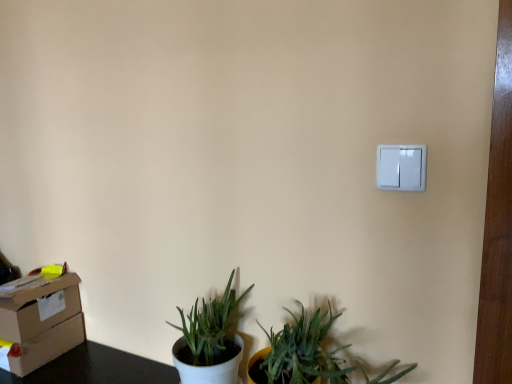
Question: Is matte brown cardboard box at lower left positioned before white matte pot at lower left?

Choices:
 (A) yes
 (B) no

Answer: (B)

Question: Is matte brown cardboard box at lower left directly adjacent to white matte pot at lower left?

Choices:
 (A) no
 (B) yes

Answer: (A)

Question: Does matte brown cardboard box at lower left lie behind white matte pot at lower left?

Choices:
 (A) yes
 (B) no

Answer: (A)

Question: From a real-world perspective, is matte brown cardboard box at lower left over white matte pot at lower left?

Choices:
 (A) yes
 (B) no

Answer: (B)

Question: Is white matte pot at lower left at the back of matte brown cardboard box at lower left?

Choices:
 (A) yes
 (B) no

Answer: (B)

Question: Does matte brown cardboard box at lower left have a lesser height compared to white matte pot at lower left?

Choices:
 (A) no
 (B) yes

Answer: (B)

Question: From the image's perspective, is white plastic light switch at upper right beneath white matte pot at lower left?

Choices:
 (A) no
 (B) yes

Answer: (A)

Question: Would you say white matte pot at lower left is part of white plastic light switch at upper right's contents?

Choices:
 (A) no
 (B) yes

Answer: (A)

Question: Is white plastic light switch at upper right wider than white matte pot at lower left?

Choices:
 (A) no
 (B) yes

Answer: (A)

Question: Is white plastic light switch at upper right bigger than white matte pot at lower left?

Choices:
 (A) no
 (B) yes

Answer: (A)

Question: Does white plastic light switch at upper right appear on the left side of white matte pot at lower left?

Choices:
 (A) yes
 (B) no

Answer: (B)

Question: Is white plastic light switch at upper right to the right of white matte pot at lower left from the viewer's perspective?

Choices:
 (A) no
 (B) yes

Answer: (B)

Question: Is white plastic light switch at upper right oriented away from matte brown cardboard box at lower left?

Choices:
 (A) no
 (B) yes

Answer: (A)